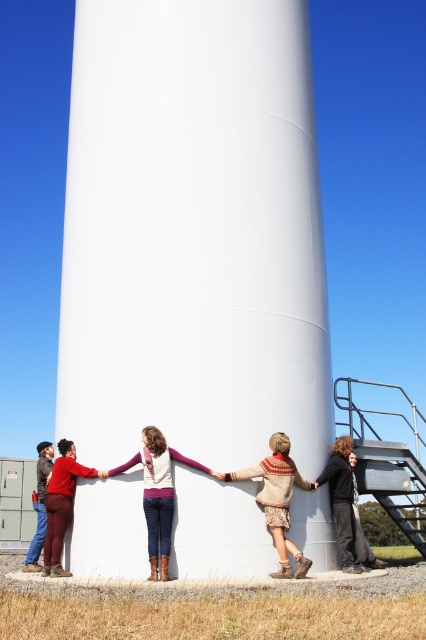
Question: Can you confirm if matte purple sweater at center is positioned to the right of dark gray sweater at lower right?

Choices:
 (A) yes
 (B) no

Answer: (B)

Question: Which point is closer to the camera?

Choices:
 (A) (69, 477)
 (B) (245, 134)
 (C) (256, 472)

Answer: (C)

Question: Is knitted sweater at center to the left of dark gray sweater at lower right from the viewer's perspective?

Choices:
 (A) no
 (B) yes

Answer: (B)

Question: Is matte purple sweater at center above matte red pants at lower left?

Choices:
 (A) no
 (B) yes

Answer: (B)

Question: Which of these objects is positioned closest to the matte red pants at lower left?

Choices:
 (A) dark gray sweater at lower right
 (B) matte purple sweater at center
 (C) knitted sweater at center
 (D) white smooth water tower at center

Answer: (B)

Question: Which object appears closest to the camera in this image?

Choices:
 (A) white smooth water tower at center
 (B) matte red pants at lower left
 (C) knitted sweater at center
 (D) matte purple sweater at center

Answer: (D)